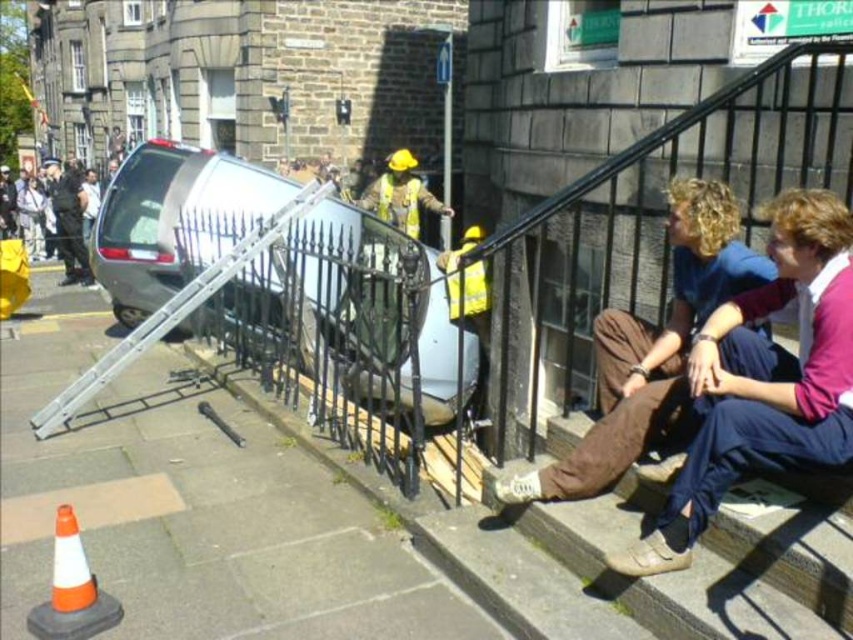
Looking at this image, you are a pedestrian standing on the gray concrete pavement at lower left and want to reach the brown cotton pants at lower right. Is there any obstacle between them?

The gray concrete pavement at lower left is positioned under the brown cotton pants at lower right, so there is no obstacle between them.

You are a construction worker assessing the damage after an accident. You see the silver metallic van at center and the brown fabric stairs at lower right. Which object is taller?

The silver metallic van at center is much taller than the brown fabric stairs at lower right.